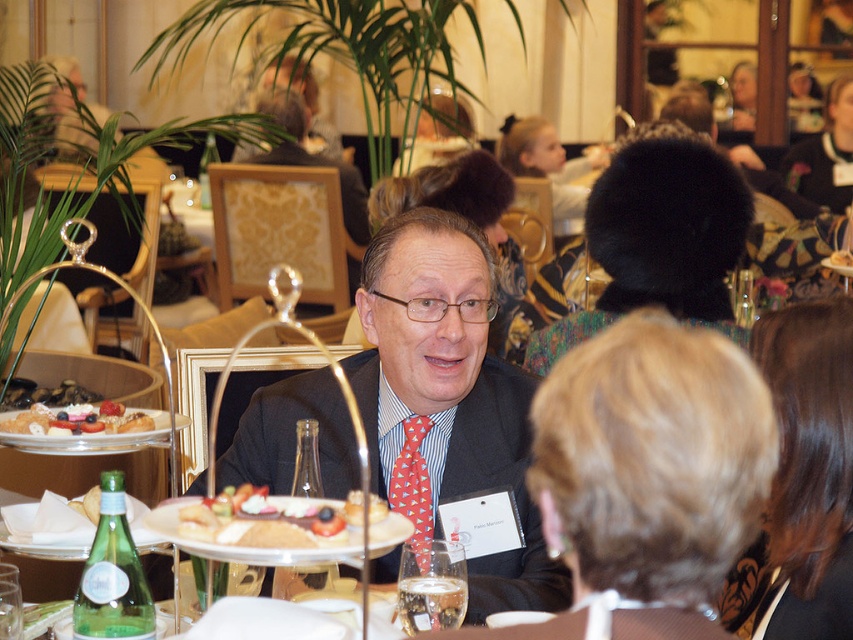
You are a guest at the tea party and see both the chocolate cake at center and the golden brown cake at center. Which cake is positioned lower on the table?

The chocolate cake at center is positioned lower on the table as it is below the golden brown cake at center.

You are at the formal gathering and want to move from your current position to the table where the man in the dark suit is seated. There are two points marked in the scene. The first point is at coordinate point (372,534) and the second is at point (41,406). Which point should you move towards to reach the table more directly?

Point (372,534) is in front of point (41,406), so you should move towards point (372,534) to reach the table more directly.

You are a guest at this tea party and you want to choose between the chocolate cake at center and the golden brown cake at center. Which cake is located to the left?

The chocolate cake at center is positioned on the left side of golden brown cake at center, so the chocolate cake at center is the one located to the left.